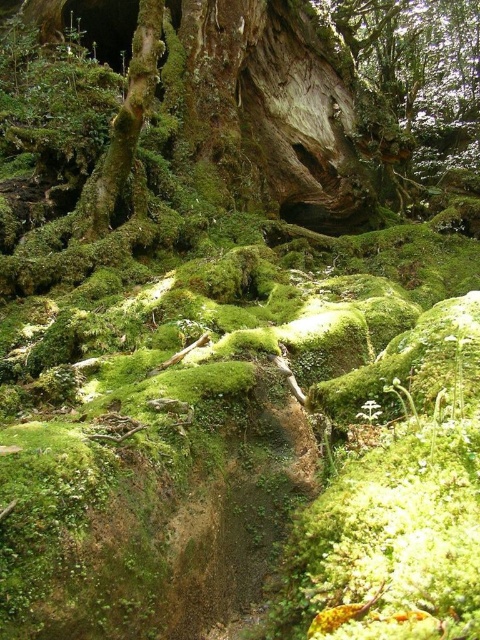
Question: From the image, what is the correct spatial relationship of rough bark tree trunk at center in relation to green mossy tree trunk at upper left?

Choices:
 (A) above
 (B) below

Answer: (A)

Question: Is rough bark tree trunk at center further to the viewer compared to green mossy tree trunk at upper left?

Choices:
 (A) yes
 (B) no

Answer: (A)

Question: Is the position of rough bark tree trunk at center less distant than that of green mossy tree trunk at upper left?

Choices:
 (A) no
 (B) yes

Answer: (A)

Question: Which of the following is the farthest from the observer?

Choices:
 (A) (144, 12)
 (B) (199, 99)

Answer: (B)

Question: Among these points, which one is farthest from the camera?

Choices:
 (A) (237, 61)
 (B) (85, 224)

Answer: (A)

Question: Which point appears farthest from the camera in this image?

Choices:
 (A) (104, 212)
 (B) (314, 77)

Answer: (B)